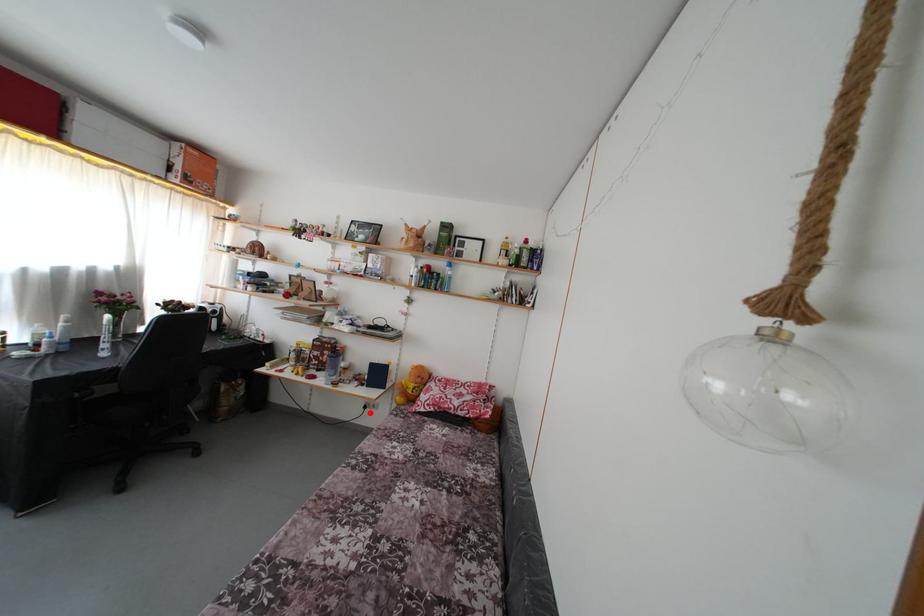
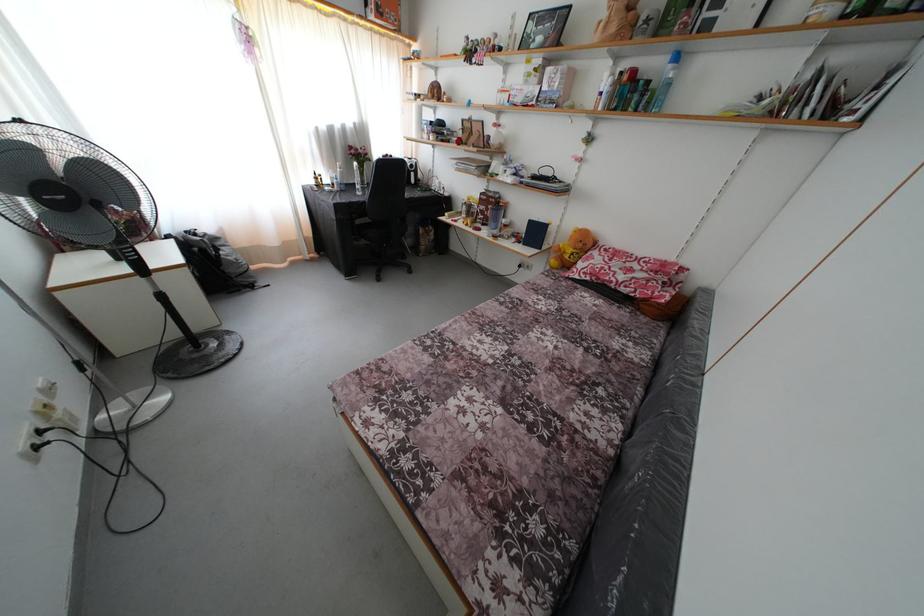
Question: I am providing you with two images of the same scene from different viewpoints. A red point is shown in image1. For the corresponding object point in image2, is it positioned nearer or farther from the camera?

Choices:
 (A) Nearer
 (B) Farther

Answer: (A)